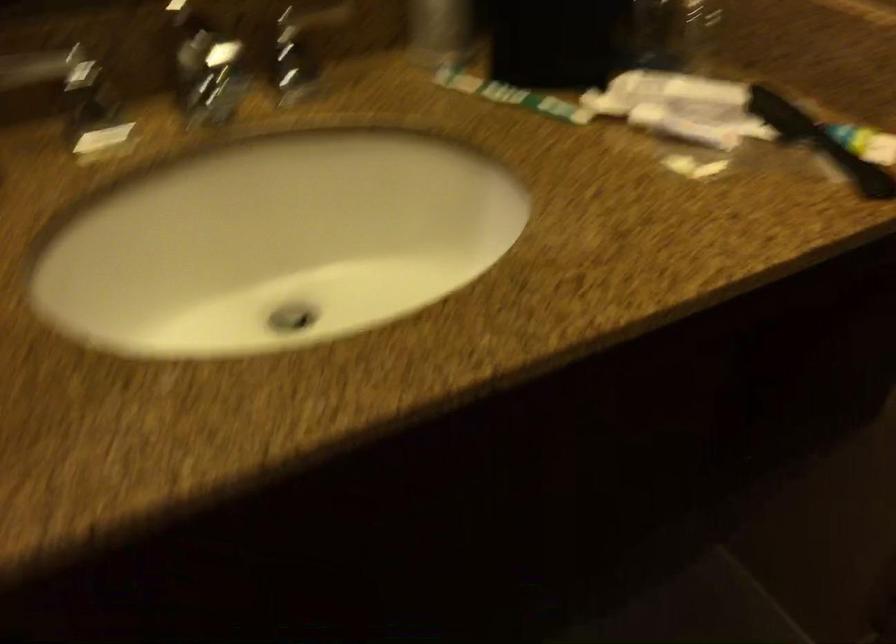
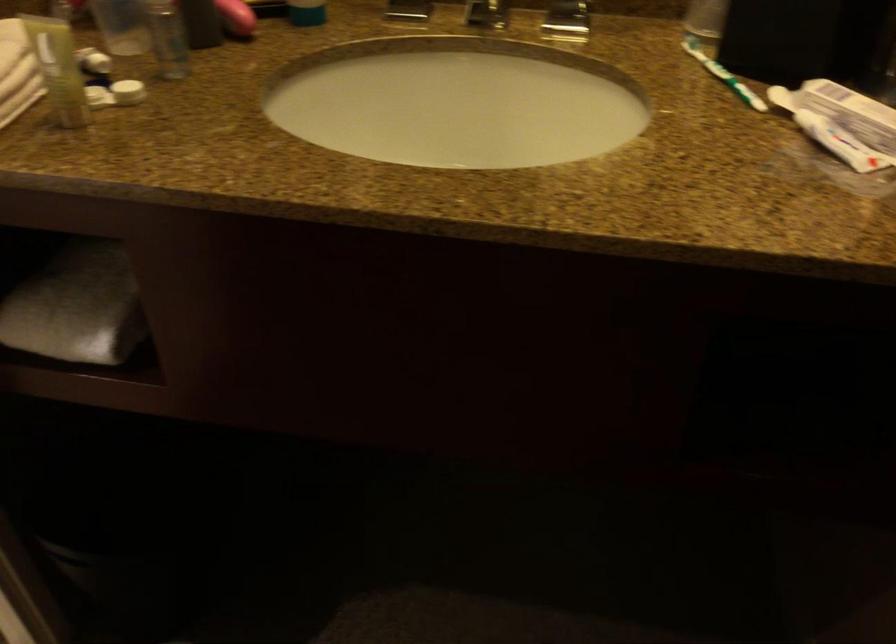
Find the pixel in the second image that matches the point at 218,214 in the first image.

(457, 102)